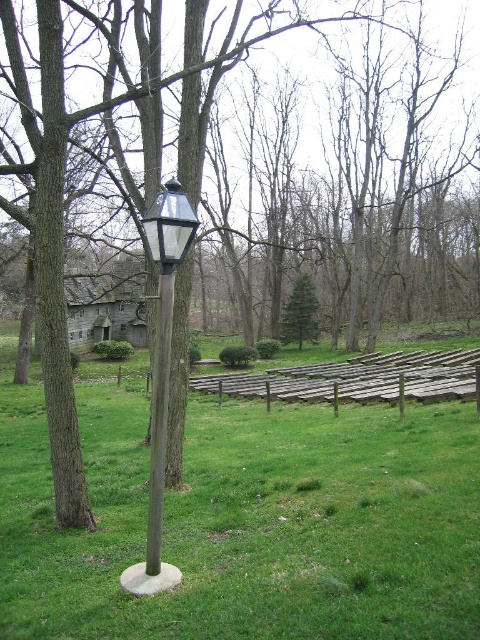
Question: Is brown wooden fence at center further to the viewer compared to green matte evergreen tree at center?

Choices:
 (A) yes
 (B) no

Answer: (B)

Question: Does brown wooden fence at center have a larger size compared to smooth wooden post at center?

Choices:
 (A) yes
 (B) no

Answer: (A)

Question: Which object appears farthest from the camera in this image?

Choices:
 (A) brown wooden fence at center
 (B) smooth wooden post at center

Answer: (A)

Question: Is brown wooden fence at center thinner than clear glass lamp post at center?

Choices:
 (A) no
 (B) yes

Answer: (A)

Question: Which point is farther to the camera?

Choices:
 (A) (158, 516)
 (B) (252, 390)

Answer: (B)

Question: Estimate the real-world distances between objects in this image. Which object is farther from the brown wooden fence at center?

Choices:
 (A) smooth wooden post at center
 (B) clear glass lamp post at center

Answer: (A)